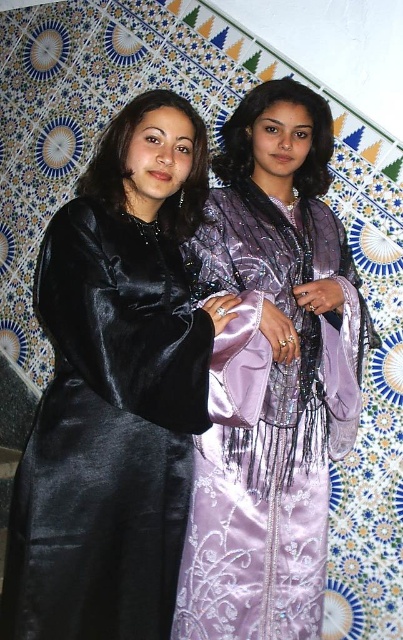
Between matte black dress at left and lavender satin dress at center, which one is positioned higher?

matte black dress at left is higher up.

Can you confirm if matte black dress at left is bigger than lavender satin dress at center?

Indeed, matte black dress at left has a larger size compared to lavender satin dress at center.

Is point (70, 448) positioned before point (276, 214)?

Yes, it is in front of point (276, 214).

At what (x,y) coordinates should I click in order to perform the action: click on matte black dress at left. Please return your answer as a coordinate pair (x, y). This screenshot has width=403, height=640. Looking at the image, I should click on (114, 388).